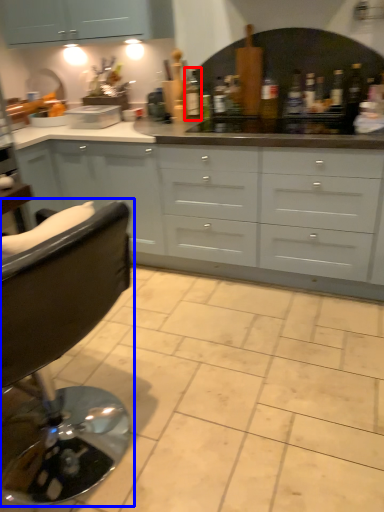
Question: Which point is further to the camera, bottle (highlighted by a red box) or chair (highlighted by a blue box)?

Choices:
 (A) bottle
 (B) chair

Answer: (A)